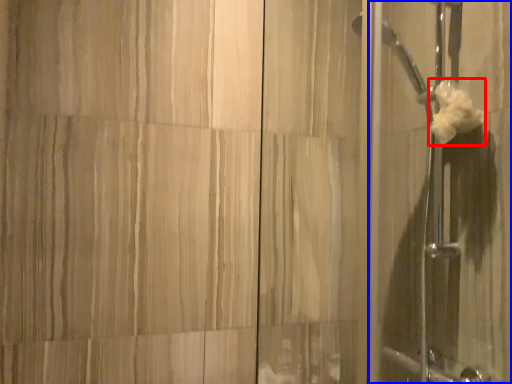
Question: Among these objects, which one is farthest to the camera, flower (highlighted by a red box) or screen door (highlighted by a blue box)?

Choices:
 (A) flower
 (B) screen door

Answer: (A)